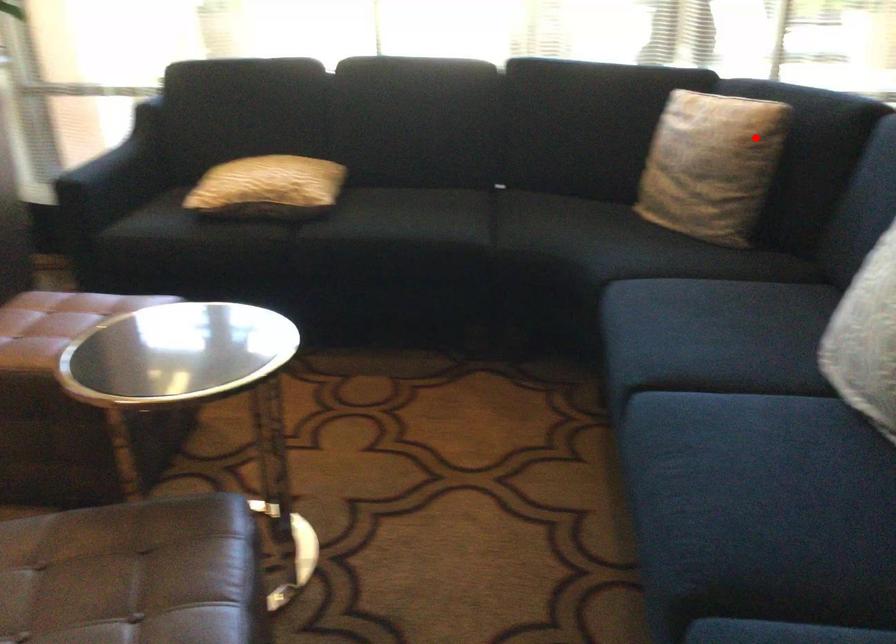
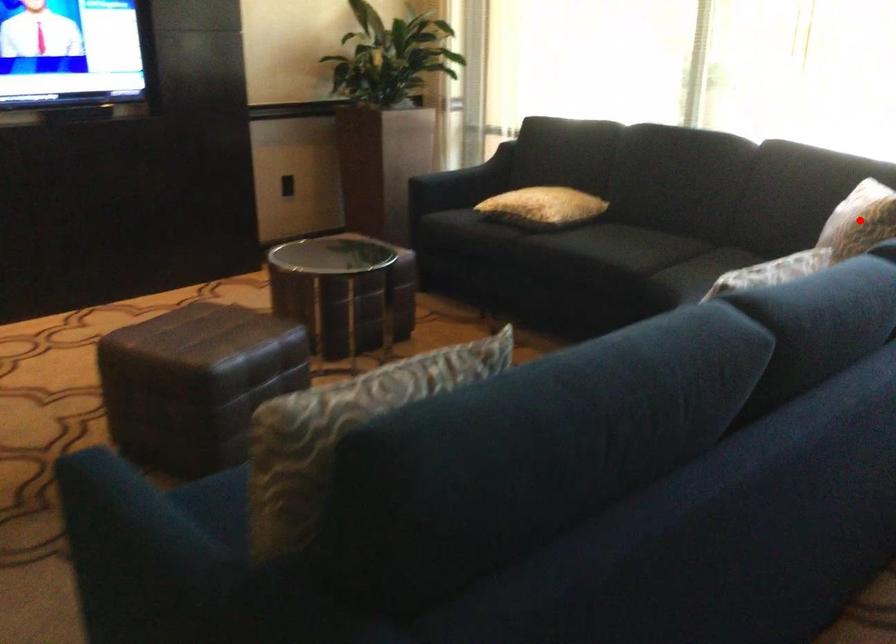
I am providing you with two images of the same scene from different viewpoints. A red point is marked on the first image and another point is marked on the second image. Is the red point in image1 aligned with the point shown in image2?

Yes